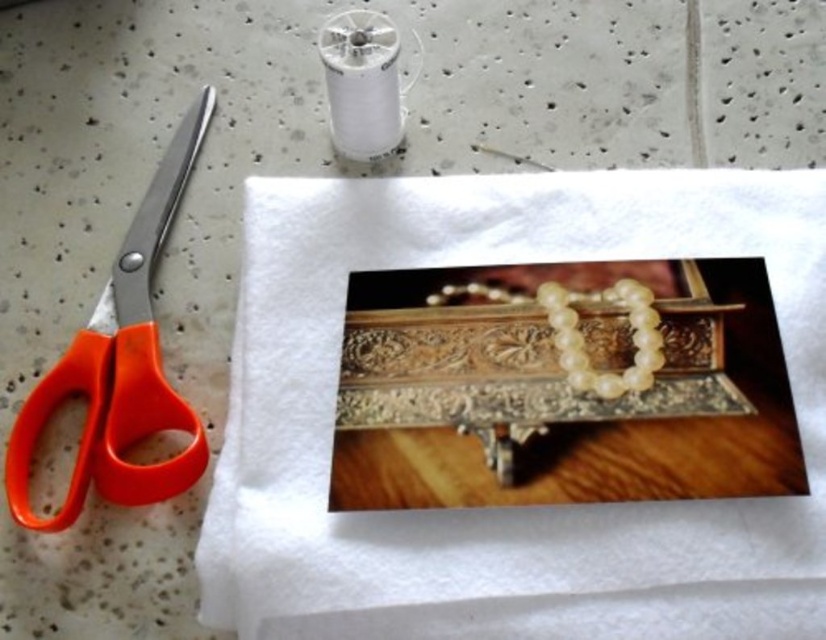
Question: Which point appears closest to the camera in this image?

Choices:
 (A) (770, 212)
 (B) (19, 513)

Answer: (B)

Question: Is white fabric at center bigger than orange plastic scissors at left?

Choices:
 (A) yes
 (B) no

Answer: (A)

Question: Is white fabric at center to the left of orange plastic scissors at left from the viewer's perspective?

Choices:
 (A) yes
 (B) no

Answer: (B)

Question: Is white fabric at center bigger than orange plastic scissors at left?

Choices:
 (A) yes
 (B) no

Answer: (A)